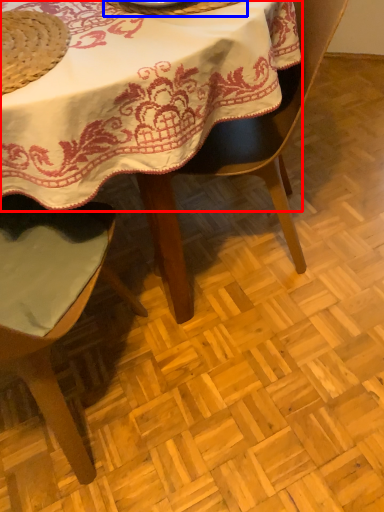
Question: Among these objects, which one is farthest to the camera, table (highlighted by a red box) or tableware (highlighted by a blue box)?

Choices:
 (A) table
 (B) tableware

Answer: (B)